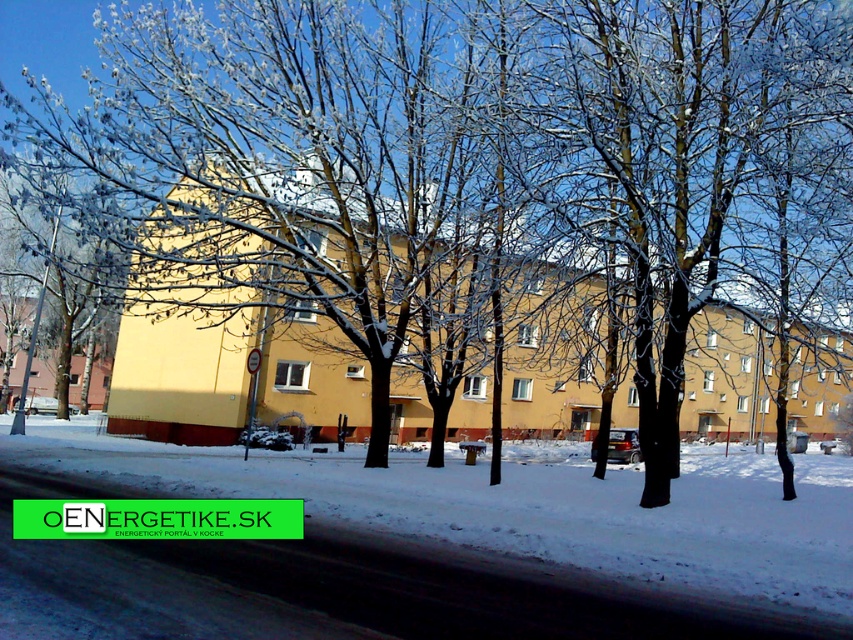
Based on the photo, is white powdery snow at center below white frosty tree at left?

Correct, white powdery snow at center is located below white frosty tree at left.

Can you confirm if white powdery snow at center is thinner than white frosty tree at left?

Incorrect, white powdery snow at center's width is not less than white frosty tree at left's.

You are a GUI agent. You are given a task and a screenshot of the screen. Output one action in this format:
    pyautogui.click(x=<x>, y=<y>)
    Task: Click on the white powdery snow at center
    The height and width of the screenshot is (640, 853).
    Given the screenshot: What is the action you would take?
    pyautogui.click(x=526, y=508)